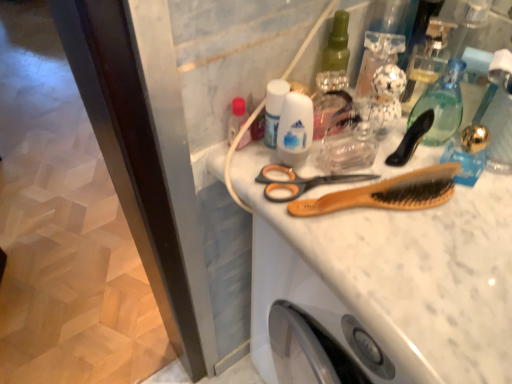
This screenshot has width=512, height=384. What are the coordinates of `vacant area in front of orange plastic scissors at center` in the screenshot? It's located at (377, 281).